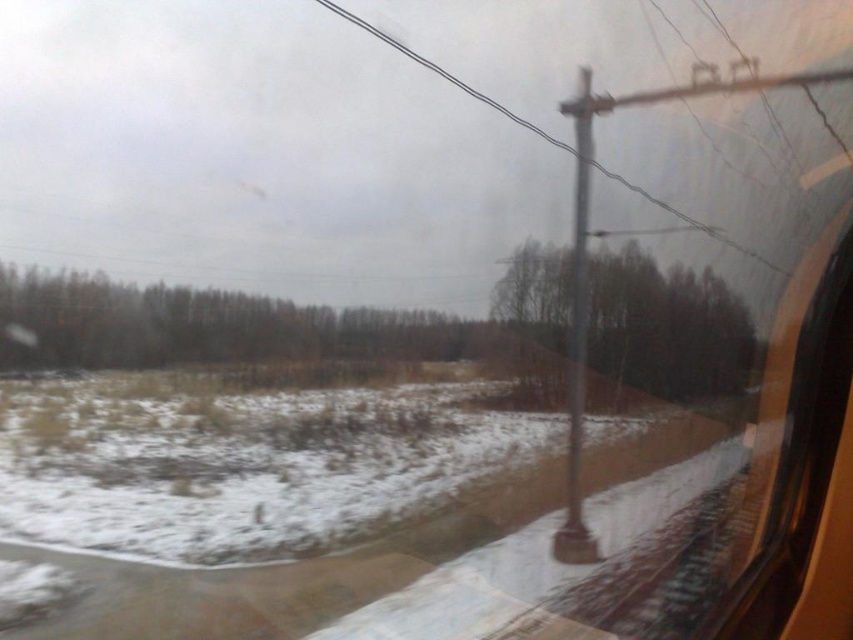
Does brown matte tree at center have a lesser width compared to metallic wire at center?

Yes.

Is brown matte tree at center bigger than metallic wire at center?

Actually, brown matte tree at center might be smaller than metallic wire at center.

Which is behind, point (659, 376) or point (784, 272)?

Positioned behind is point (659, 376).

In order to click on brown matte tree at center in this screenshot , I will do `click(666, 326)`.

Does green matte trees at center have a greater width compared to metallic wire at center?

Indeed, green matte trees at center has a greater width compared to metallic wire at center.

Is point (276, 346) closer to viewer compared to point (759, 257)?

No, (276, 346) is further to viewer.

Image resolution: width=853 pixels, height=640 pixels. In order to click on green matte trees at center in this screenshot , I will do `click(199, 324)`.

Is green matte trees at center to the right of brown matte tree at center from the viewer's perspective?

Incorrect, green matte trees at center is not on the right side of brown matte tree at center.

Who is higher up, green matte trees at center or brown matte tree at center?

Positioned higher is brown matte tree at center.

Which is in front, point (339, 342) or point (505, 307)?

Point (505, 307) is more forward.

This screenshot has width=853, height=640. Find the location of `green matte trees at center`. green matte trees at center is located at coordinates (199, 324).